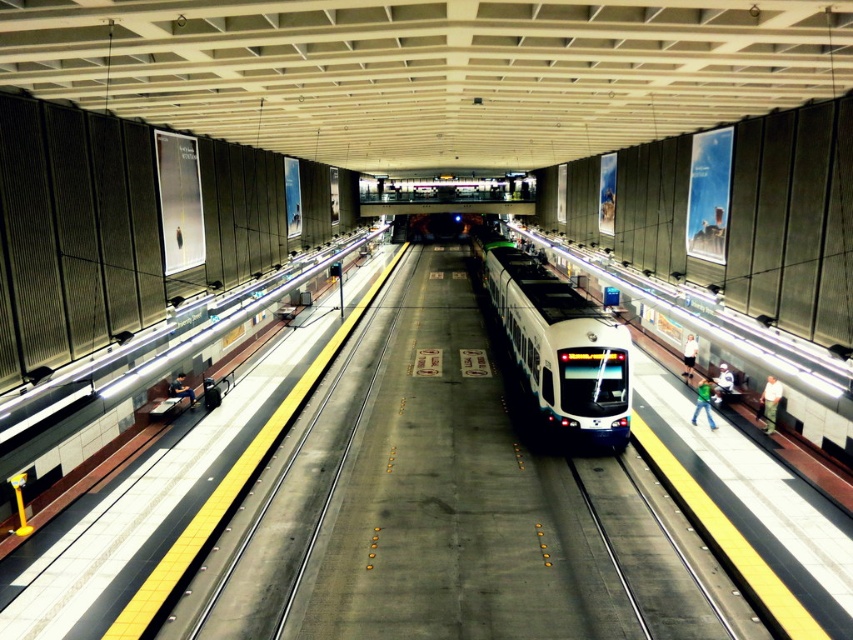
Can you confirm if white glossy train at center is bigger than dark blue jeans at left?

Indeed, white glossy train at center has a larger size compared to dark blue jeans at left.

Is point (538, 326) farther from camera compared to point (192, 403)?

No, it is in front of (192, 403).

I want to click on white glossy train at center, so click(x=560, y=344).

Can you confirm if white glossy train at center is taller than green fabric shirt at right?

Correct, white glossy train at center is much taller as green fabric shirt at right.

Identify the location of white glossy train at center. (560, 344).

I want to click on white glossy train at center, so click(x=560, y=344).

Who is higher up, white cotton shirt at right or green fabric shirt at right?

green fabric shirt at right is higher up.

Between white cotton shirt at right and green fabric shirt at right, which one appears on the right side from the viewer's perspective?

From the viewer's perspective, white cotton shirt at right appears more on the right side.

Where is `white cotton shirt at right`? white cotton shirt at right is located at coordinates (769, 403).

Image resolution: width=853 pixels, height=640 pixels. I want to click on white cotton shirt at right, so click(x=769, y=403).